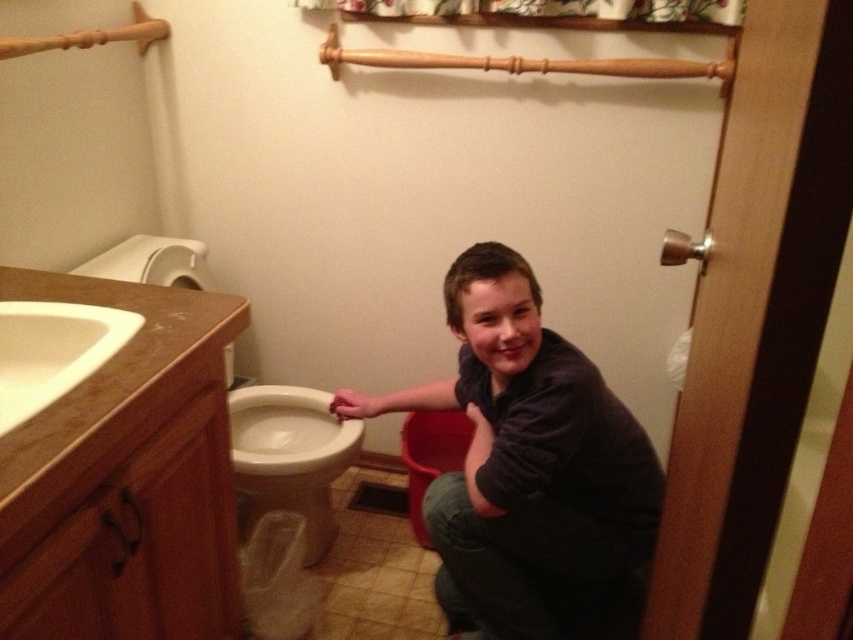
Is white glossy toilet bowl at lower left shorter than white glossy sink at upper left?

In fact, white glossy toilet bowl at lower left may be taller than white glossy sink at upper left.

Identify the location of white glossy toilet bowl at lower left. (289, 458).

Locate an element on the screen. The width and height of the screenshot is (853, 640). white glossy toilet bowl at lower left is located at coordinates (289, 458).

Is white glossy toilet at left positioned behind white glossy toilet bowl at lower left?

Yes, white glossy toilet at left is behind white glossy toilet bowl at lower left.

This screenshot has width=853, height=640. I want to click on white glossy toilet at left, so click(x=291, y=458).

Which is more to the right, dark blue fabric at center or white glossy sink at upper left?

From the viewer's perspective, dark blue fabric at center appears more on the right side.

Does dark blue fabric at center have a greater width compared to white glossy sink at upper left?

Indeed, dark blue fabric at center has a greater width compared to white glossy sink at upper left.

Does point (636, 444) come in front of point (3, 317)?

No, it is behind (3, 317).

Image resolution: width=853 pixels, height=640 pixels. What are the coordinates of `dark blue fabric at center` in the screenshot? It's located at (525, 460).